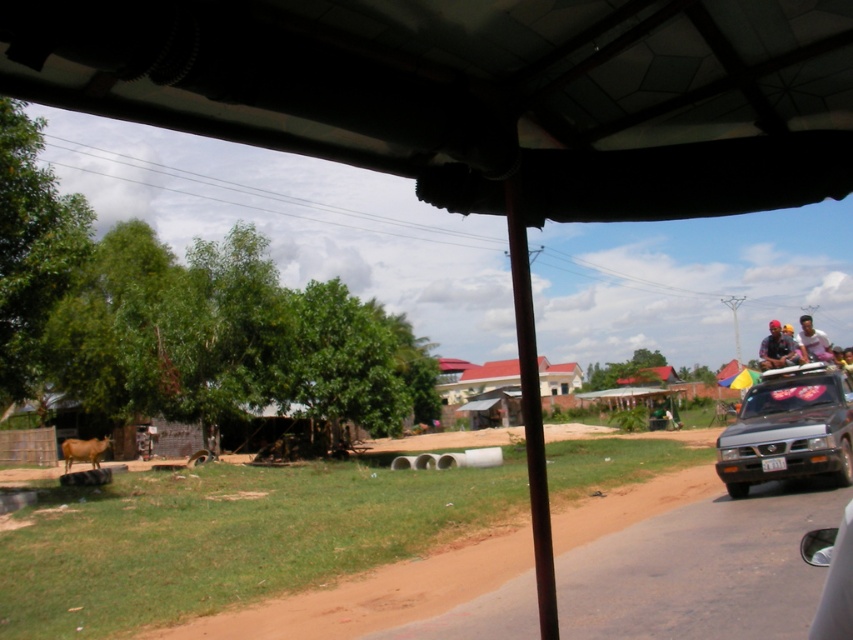
You are a passenger in the tuk tuk and want to take a photo of the brown matte cow at lower left. However, the red corrugated metal hut at center is blocking your view. Can you move your head slightly to the left to get a clear shot?

The red corrugated metal hut at center is in front of the brown matte cow at lower left, so moving your head to the left might allow you to see around the hut and capture the cow in your photo.

Consider the image. You are a passenger in the vehicle and want to look out to see the dirt track ahead. Which object, the brown dirt track at lower left or the transparent glass car window at lower right, is positioned to the right side from your viewpoint?

The brown dirt track at lower left is to the right of the transparent glass car window at lower right, so you would look towards the brown dirt track at lower left to see the dirt track ahead.

You are a passenger in the tuk tuk and you see the yellow fabric hat at upper right and the brown matte cow at lower left. Which object is larger from your viewpoint?

The yellow fabric hat at upper right is bigger than brown matte cow at lower left.